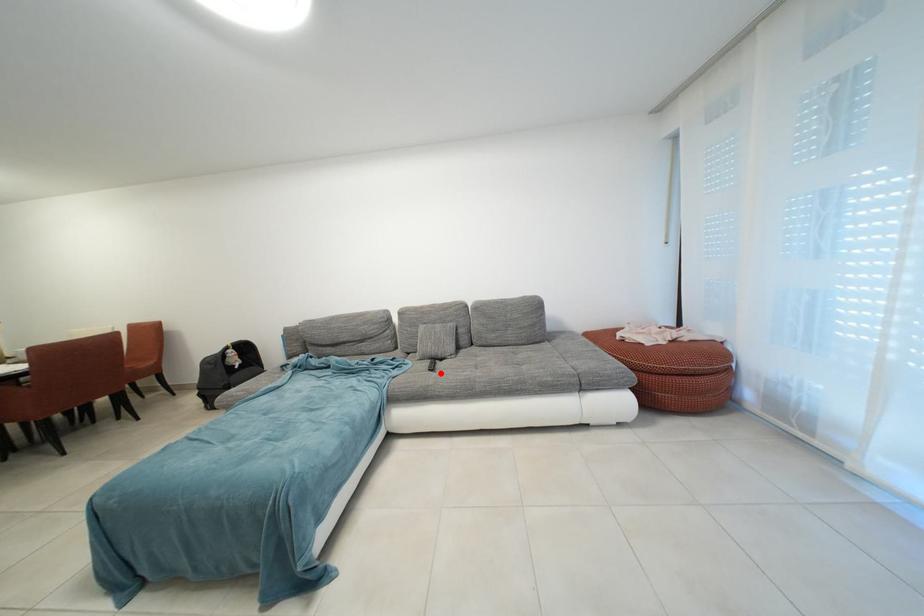
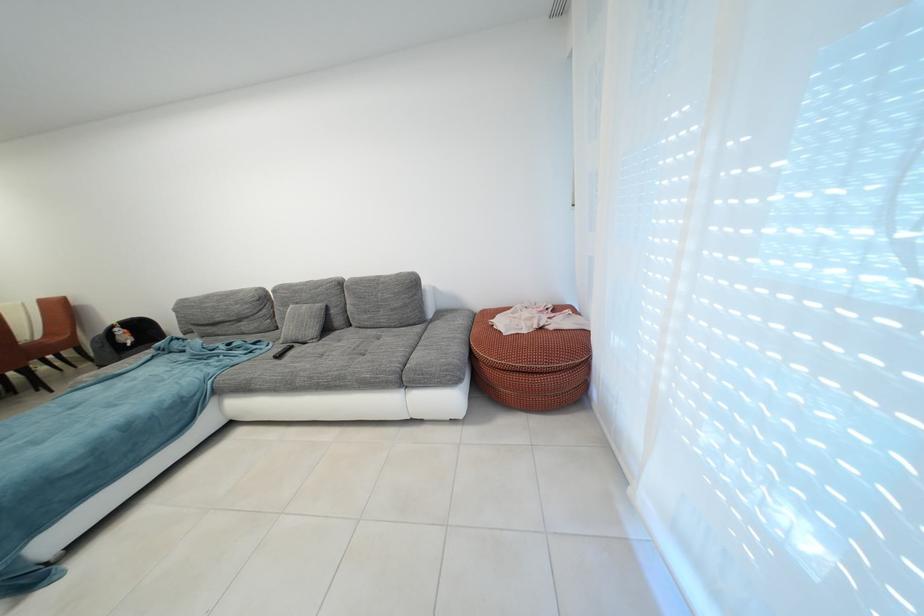
Where in the second image is the point corresponding to the highlighted location from the first image?

(287, 361)